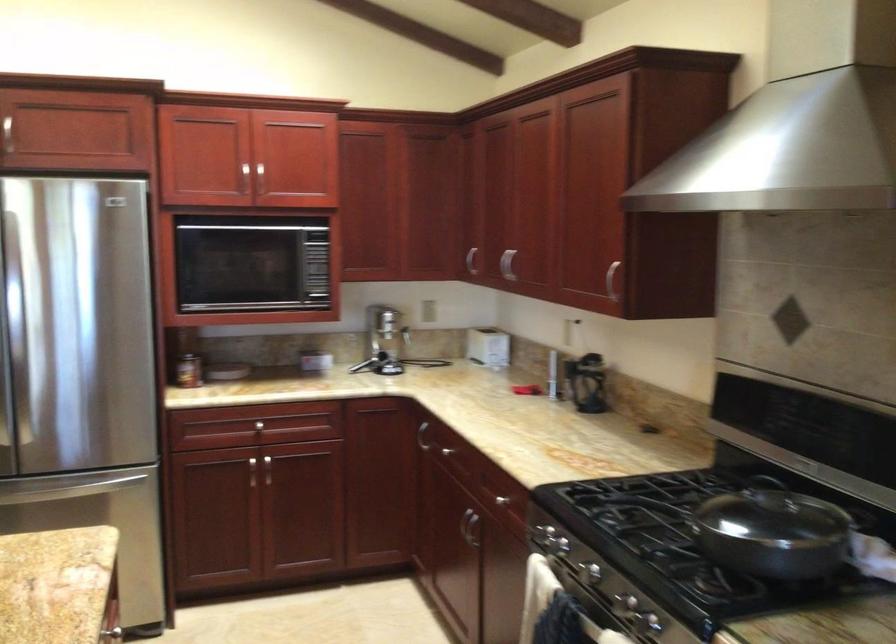
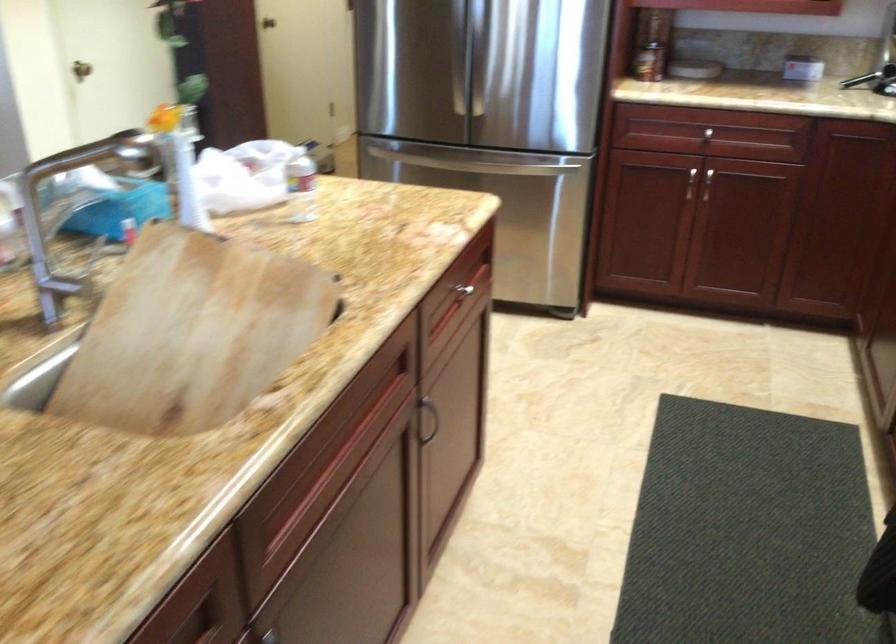
The images are taken continuously from a first-person perspective. In which direction is your viewpoint rotating?

The camera's rotation is toward left-down.